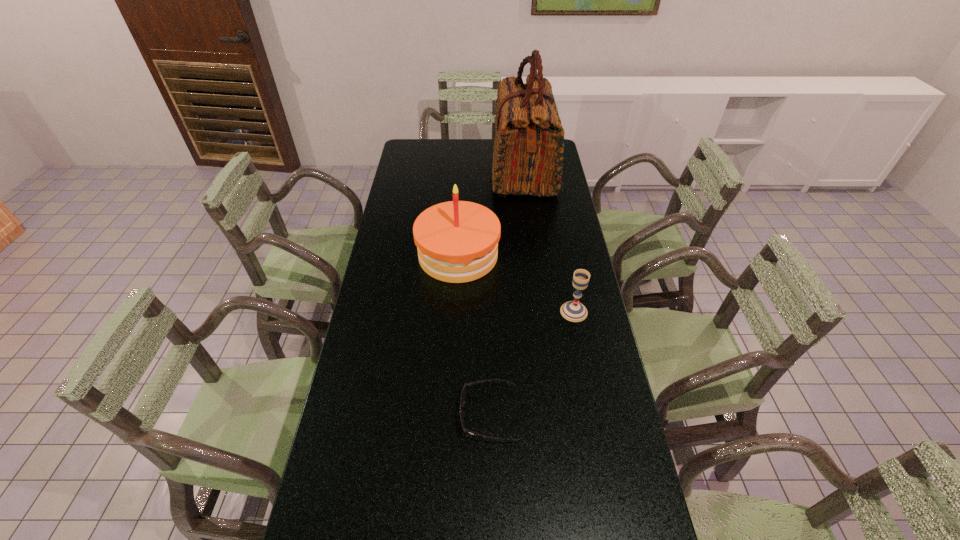
This screenshot has height=540, width=960. Find the location of `object that is at the far right corner`. object that is at the far right corner is located at coordinates pos(528,148).

Image resolution: width=960 pixels, height=540 pixels. What are the coordinates of `free space at the far edge of the desktop` in the screenshot? It's located at (448, 142).

Where is `free space at the left edge of the desktop`? free space at the left edge of the desktop is located at coordinates (357, 333).

At what (x,y) coordinates should I click in order to perform the action: click on free space at the right edge of the desktop. Please return your answer as a coordinate pair (x, y). Looking at the image, I should click on (564, 177).

I want to click on free point between the shopping bag and the shortest object, so click(507, 292).

Where is `free spot between the farthest object and the chalice`? The height and width of the screenshot is (540, 960). free spot between the farthest object and the chalice is located at coordinates (549, 241).

Locate an element on the screen. The image size is (960, 540). free spot between the second shortest object and the shopping bag is located at coordinates (549, 241).

You are a GUI agent. You are given a task and a screenshot of the screen. Output one action in this format:
    pyautogui.click(x=<x>, y=<y>)
    Task: Click on the vacant area that lies between the third nearest object and the second nearest object
    Image resolution: width=960 pixels, height=540 pixels.
    Given the screenshot: What is the action you would take?
    pyautogui.click(x=516, y=284)

You are a GUI agent. You are given a task and a screenshot of the screen. Output one action in this format:
    pyautogui.click(x=<x>, y=<y>)
    Task: Click on the free space between the chalice and the nearest object
    This screenshot has width=960, height=540.
    Given the screenshot: What is the action you would take?
    pyautogui.click(x=532, y=363)

The width and height of the screenshot is (960, 540). Identify the location of free space between the third tallest object and the tallest object. coord(549,241).